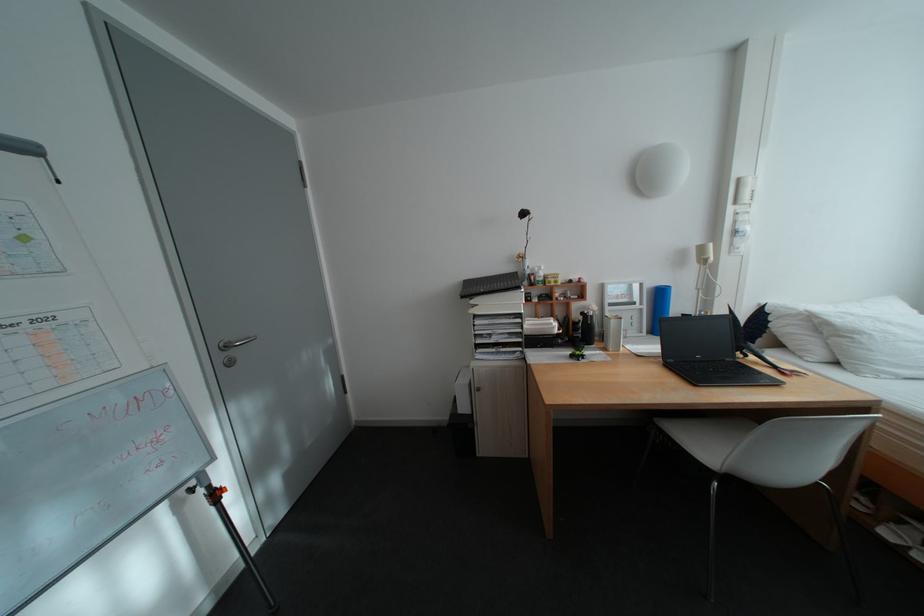
The width and height of the screenshot is (924, 616). I want to click on blue cylinder, so click(x=660, y=306).